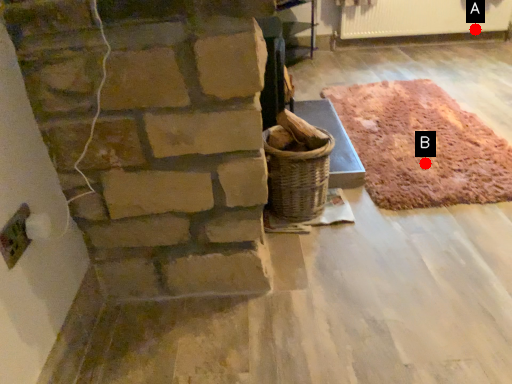
Question: Two points are circled on the image, labeled by A and B beside each circle. Among these points, which one is farthest from the camera?

Choices:
 (A) A is further
 (B) B is further

Answer: (A)